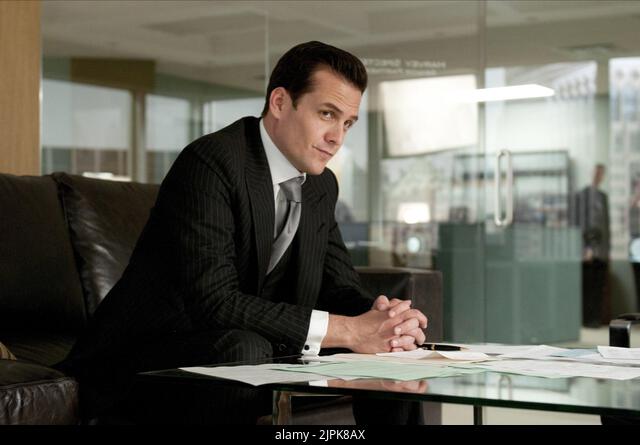
Where is `pen`? The image size is (640, 445). pen is located at coordinates [442, 346].